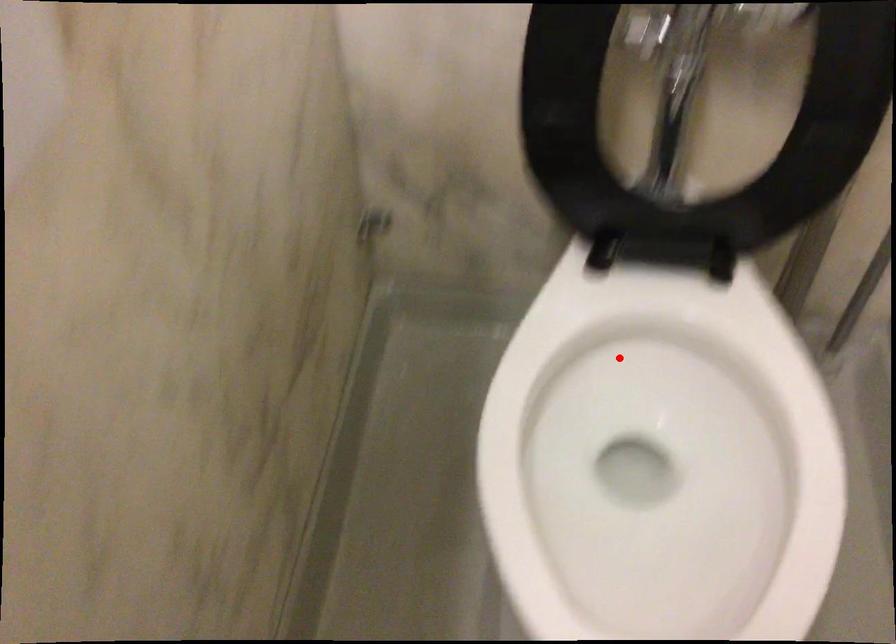
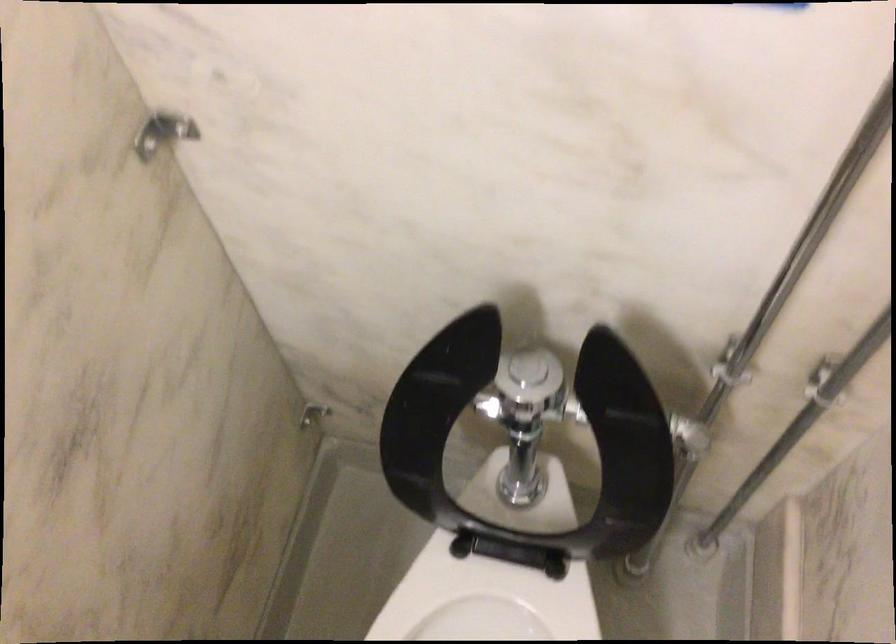
In the second image, find the point that corresponds to the highlighted location in the first image.

(487, 605)